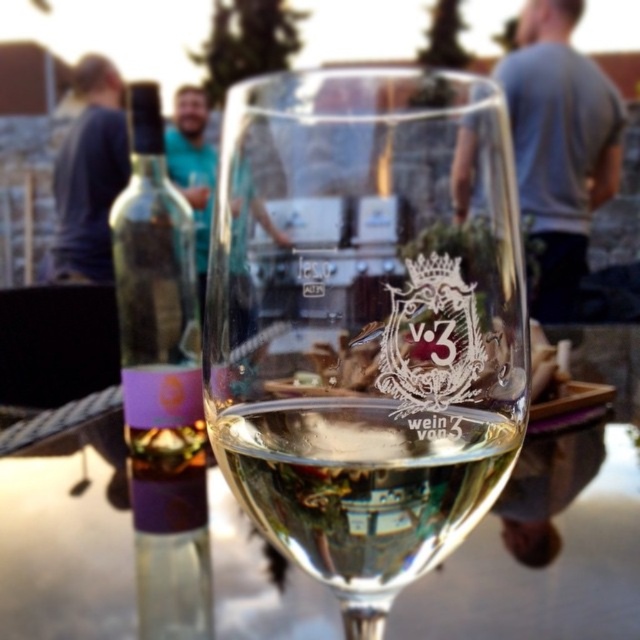
Question: Observing the image, what is the correct spatial positioning of clear glass wine at center in reference to translucent glass bottle at left?

Choices:
 (A) below
 (B) above

Answer: (A)

Question: Which object is closer to the camera taking this photo?

Choices:
 (A) clear glass wine glass at center
 (B) transparent glass at center

Answer: (A)

Question: Among these points, which one is farthest from the camera?

Choices:
 (A) (170, 509)
 (B) (113, 90)
 (C) (298, 456)
 (D) (616, 547)

Answer: (B)

Question: Estimate the real-world distances between objects in this image. Which object is closer to the translucent glass bottle at left?

Choices:
 (A) clear glass wine glass at center
 (B) transparent glass at center

Answer: (B)

Question: Can you confirm if transparent glass at center is wider than translucent glass bottle at left?

Choices:
 (A) yes
 (B) no

Answer: (A)

Question: Can you confirm if gray cotton shirt at upper center is positioned below blue fabric shirt at upper left?

Choices:
 (A) no
 (B) yes

Answer: (B)